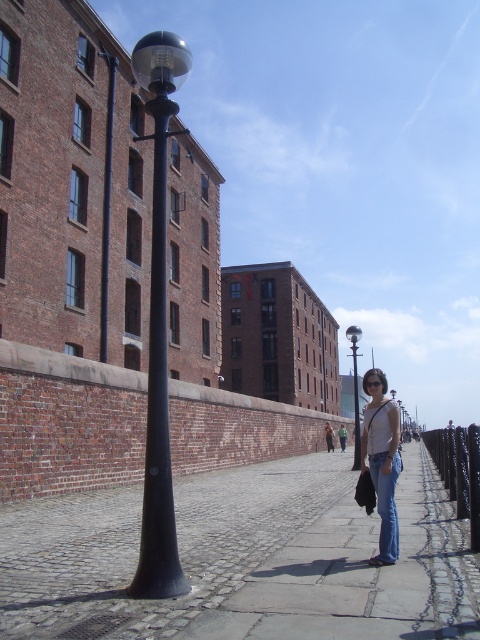
Which is above, cobblestone pavement at center or denim jeans at center?

denim jeans at center is higher up.

Does cobblestone pavement at center appear over denim jeans at center?

Incorrect, cobblestone pavement at center is not positioned above denim jeans at center.

The image size is (480, 640). In order to click on cobblestone pavement at center in this screenshot , I will do `click(292, 563)`.

Does cobblestone pavement at center appear on the left side of black polished metal streetlight at center?

Indeed, cobblestone pavement at center is positioned on the left side of black polished metal streetlight at center.

Between cobblestone pavement at center and black polished metal streetlight at center, which one has more height?

Standing taller between the two is black polished metal streetlight at center.

Identify the location of cobblestone pavement at center. The image size is (480, 640). (292, 563).

Locate an element on the screen. cobblestone pavement at center is located at coordinates (292, 563).

Is the position of cobblestone pavement at center more distant than that of black matte lamp post at left?

No.

Does point (100, 577) lie in front of point (144, 577)?

No.

Describe the element at coordinates (292, 563) in the screenshot. I see `cobblestone pavement at center` at that location.

What are the coordinates of `cobblestone pavement at center` in the screenshot? It's located at (292, 563).